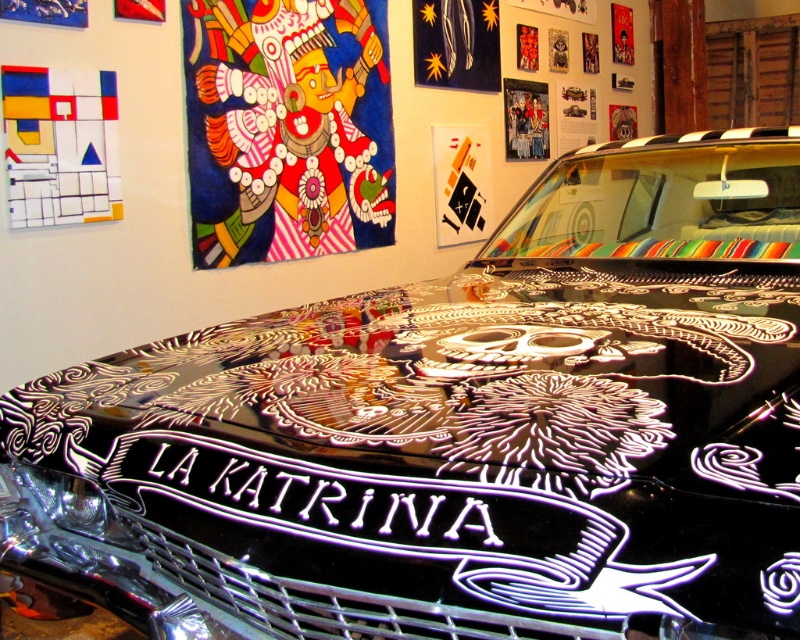
Can you confirm if vibrant painted mask at upper left is positioned to the left of matte white geometric shapes at upper left?

No, vibrant painted mask at upper left is not to the left of matte white geometric shapes at upper left.

Does vibrant painted mask at upper left have a greater width compared to matte white geometric shapes at upper left?

Indeed, vibrant painted mask at upper left has a greater width compared to matte white geometric shapes at upper left.

Is point (184, 44) positioned in front of point (16, 138)?

No, (184, 44) is behind (16, 138).

Identify the location of vibrant painted mask at upper left. The width and height of the screenshot is (800, 640). (286, 129).